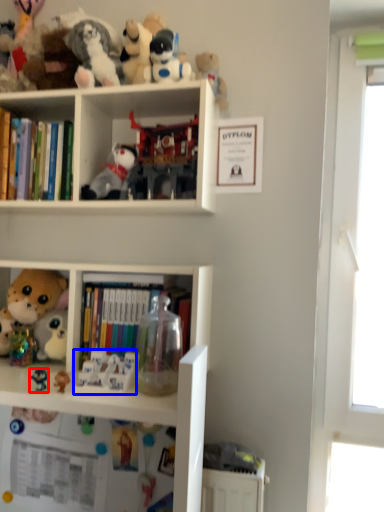
Question: Which object is closer to the camera taking this photo, toy (highlighted by a red box) or toy (highlighted by a blue box)?

Choices:
 (A) toy
 (B) toy

Answer: (B)